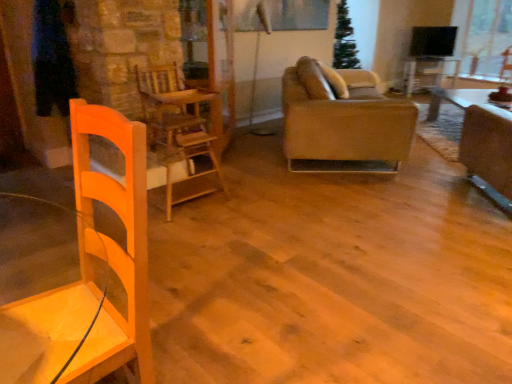
Question: Does point (291, 3) appear closer or farther from the camera than point (175, 117)?

Choices:
 (A) farther
 (B) closer

Answer: (A)

Question: From a real-world perspective, is matte glass window screen at upper center physically located above or below wooden chair at center?

Choices:
 (A) above
 (B) below

Answer: (A)

Question: Considering the real-world distances, which object is closest to the leather couch at center?

Choices:
 (A) wooden chair at center
 (B) wooden table at center
 (C) matte glass window screen at upper center

Answer: (A)

Question: Considering the real-world distances, which object is closest to the wooden chair at center?

Choices:
 (A) leather couch at center
 (B) wooden table at center
 (C) matte glass window screen at upper center

Answer: (A)